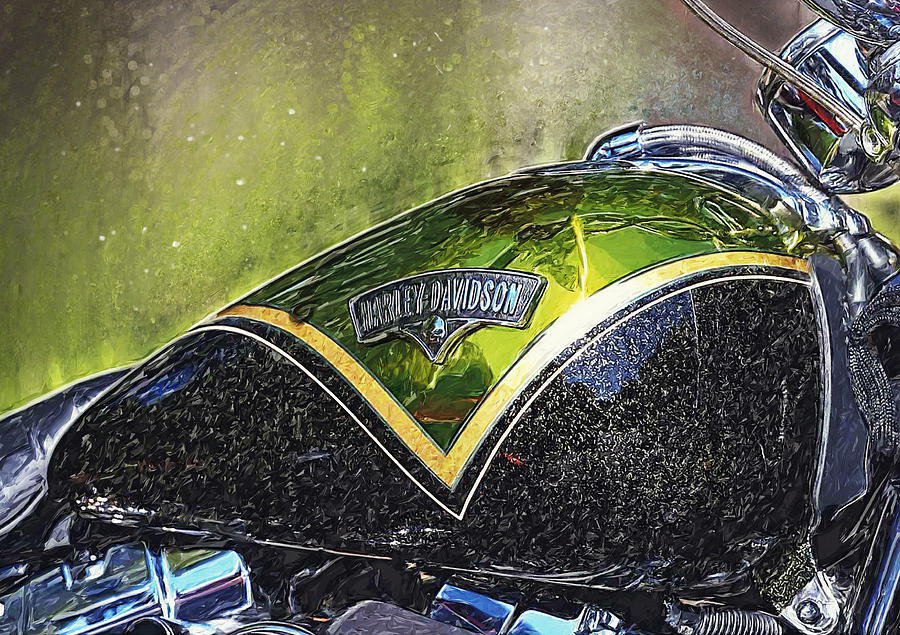
Identify the location of painting. Image resolution: width=900 pixels, height=635 pixels. (293, 237).